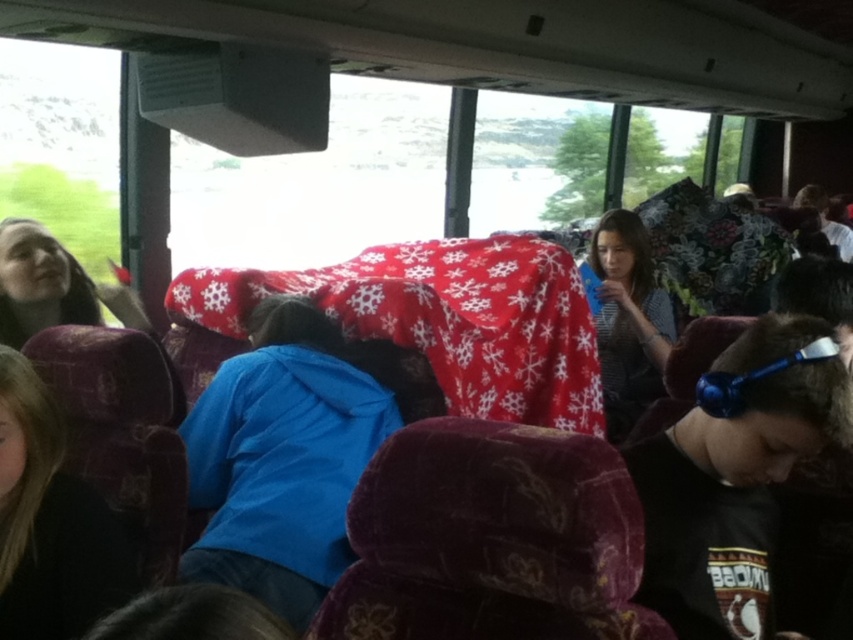
From the picture: Between blue fleece jacket at center and blue metallic headphones at lower right, which one appears on the left side from the viewer's perspective?

blue fleece jacket at center

Is blue fleece jacket at center taller than blue metallic headphones at lower right?

Correct, blue fleece jacket at center is much taller as blue metallic headphones at lower right.

What do you see at coordinates (283, 456) in the screenshot?
I see `blue fleece jacket at center` at bounding box center [283, 456].

At what (x,y) coordinates should I click in order to perform the action: click on blue fleece jacket at center. Please return your answer as a coordinate pair (x, y). Looking at the image, I should click on (283, 456).

Is blue metallic headphones at lower right further to the viewer compared to dark brown leather jacket at lower left?

No.

Is point (708, 465) behind point (109, 531)?

No, it is not.

Does point (698, 410) come behind point (10, 433)?

No, it is in front of (10, 433).

Identify the location of blue metallic headphones at lower right. The width and height of the screenshot is (853, 640). (733, 476).

Can you confirm if blue fleece jacket at center is shorter than dark brown leather jacket at lower left?

In fact, blue fleece jacket at center may be taller than dark brown leather jacket at lower left.

Is blue fleece jacket at center below dark brown leather jacket at lower left?

Yes.

Does point (262, 316) come farther from viewer compared to point (9, 540)?

Yes, it is behind point (9, 540).

Image resolution: width=853 pixels, height=640 pixels. Identify the location of blue fleece jacket at center. (283, 456).